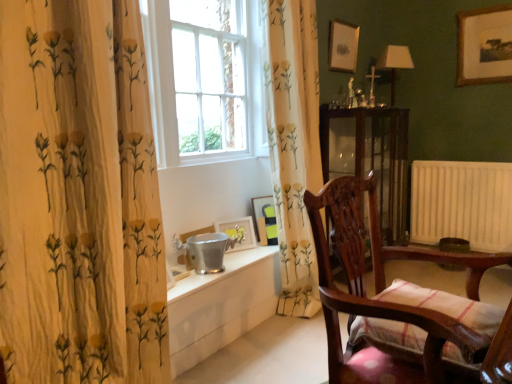
Question: Is transparent glass cabinet at center smaller than matte white picture frame at upper center, the fourth picture frame ordered from the bottom?

Choices:
 (A) no
 (B) yes

Answer: (A)

Question: Can you confirm if transparent glass cabinet at center is positioned to the left of matte white picture frame at upper center, which ranks as the fourth picture frame in left-to-right order?

Choices:
 (A) no
 (B) yes

Answer: (A)

Question: Considering the relative sizes of transparent glass cabinet at center and matte white picture frame at upper center, which ranks as the fourth picture frame in left-to-right order, in the image provided, is transparent glass cabinet at center taller than matte white picture frame at upper center, which ranks as the fourth picture frame in left-to-right order,?

Choices:
 (A) no
 (B) yes

Answer: (B)

Question: Can you confirm if transparent glass cabinet at center is positioned to the right of matte white picture frame at upper center, which ranks as the fourth picture frame in left-to-right order?

Choices:
 (A) yes
 (B) no

Answer: (A)

Question: Is transparent glass cabinet at center next to matte white picture frame at upper center, which ranks as the fourth picture frame in left-to-right order?

Choices:
 (A) no
 (B) yes

Answer: (A)

Question: Is wooden chair with striped cushion at right in front of or behind floral fabric curtain at center, which appears as the 2th curtain when viewed from the front, in the image?

Choices:
 (A) front
 (B) behind

Answer: (A)

Question: From the image's perspective, is wooden chair with striped cushion at right above or below floral fabric curtain at center, which appears as the 2th curtain when viewed from the front?

Choices:
 (A) below
 (B) above

Answer: (A)

Question: From a real-world perspective, is wooden chair with striped cushion at right above or below floral fabric curtain at center, placed as the first curtain when sorted from back to front?

Choices:
 (A) above
 (B) below

Answer: (B)

Question: Would you say wooden chair with striped cushion at right is inside or outside floral fabric curtain at center, which appears as the first curtain when viewed from the right?

Choices:
 (A) outside
 (B) inside

Answer: (A)

Question: From the image's perspective, relative to white glass window at center, is matte white picture frame at upper center, which ranks as the 2th picture frame in top-to-bottom order, above or below?

Choices:
 (A) above
 (B) below

Answer: (A)

Question: Is matte white picture frame at upper center, the fourth picture frame ordered from the bottom, bigger or smaller than white glass window at center?

Choices:
 (A) small
 (B) big

Answer: (A)

Question: Relative to white glass window at center, is matte white picture frame at upper center, which ranks as the fourth picture frame in left-to-right order, in front or behind?

Choices:
 (A) behind
 (B) front

Answer: (A)

Question: From a real-world perspective, relative to white glass window at center, is matte white picture frame at upper center, the fourth picture frame ordered from the bottom, vertically above or below?

Choices:
 (A) below
 (B) above

Answer: (B)

Question: Is white glass window at center bigger or smaller than matte white picture frame at upper center, which ranks as the fourth picture frame in left-to-right order?

Choices:
 (A) big
 (B) small

Answer: (A)

Question: Would you say white glass window at center is inside or outside matte white picture frame at upper center, which ranks as the fourth picture frame in left-to-right order?

Choices:
 (A) inside
 (B) outside

Answer: (B)